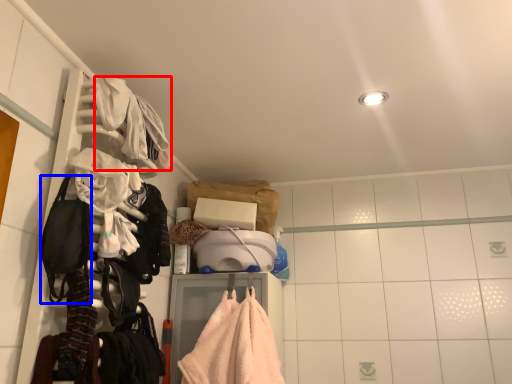
Question: Which object is closer to the camera taking this photo, clothing (highlighted by a red box) or gear (highlighted by a blue box)?

Choices:
 (A) clothing
 (B) gear

Answer: (B)